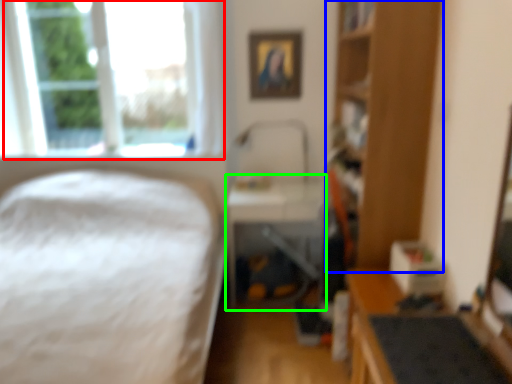
Question: Which object is the closest to the window (highlighted by a red box)? Choose among these: bookshelf (highlighted by a blue box) or table (highlighted by a green box).

Choices:
 (A) bookshelf
 (B) table

Answer: (B)